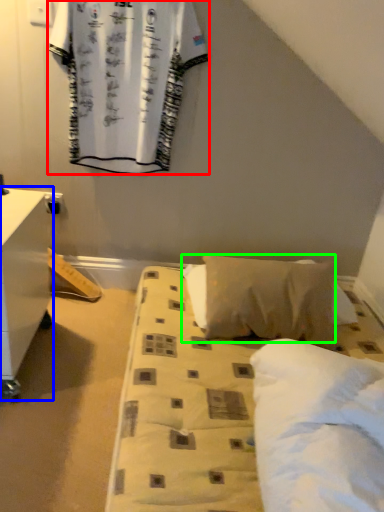
Question: Which is farther away from curtain (highlighted by a red box)? nightstand (highlighted by a blue box) or pillow (highlighted by a green box)?

Choices:
 (A) nightstand
 (B) pillow

Answer: (B)